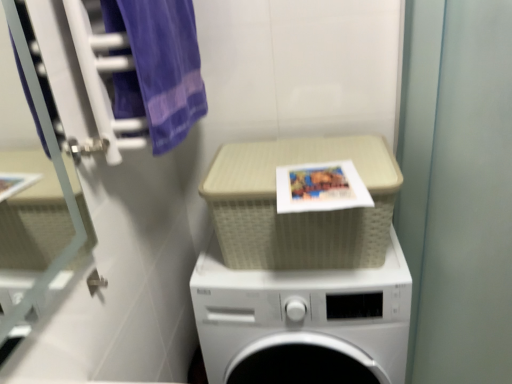
Question: Is green matte screen door at right shorter than white plastic washing machine at center?

Choices:
 (A) no
 (B) yes

Answer: (A)

Question: Is green matte screen door at right smaller than white plastic washing machine at center?

Choices:
 (A) no
 (B) yes

Answer: (A)

Question: From the image's perspective, is green matte screen door at right located above white plastic washing machine at center?

Choices:
 (A) yes
 (B) no

Answer: (A)

Question: Is green matte screen door at right thinner than white plastic washing machine at center?

Choices:
 (A) yes
 (B) no

Answer: (B)

Question: Would you say green matte screen door at right is outside white plastic washing machine at center?

Choices:
 (A) yes
 (B) no

Answer: (A)

Question: Is green matte screen door at right situated inside matte paper book cover at center or outside?

Choices:
 (A) inside
 (B) outside

Answer: (B)

Question: In the image, is green matte screen door at right on the left side or the right side of matte paper book cover at center?

Choices:
 (A) left
 (B) right

Answer: (B)

Question: From their relative heights in the image, would you say green matte screen door at right is taller or shorter than matte paper book cover at center?

Choices:
 (A) short
 (B) tall

Answer: (B)

Question: Based on their sizes in the image, would you say green matte screen door at right is bigger or smaller than matte paper book cover at center?

Choices:
 (A) small
 (B) big

Answer: (B)

Question: Is white plastic washing machine at center wider or thinner than purple cotton towel at upper left?

Choices:
 (A) thin
 (B) wide

Answer: (B)

Question: From a real-world perspective, is white plastic washing machine at center positioned above or below purple cotton towel at upper left?

Choices:
 (A) above
 (B) below

Answer: (B)

Question: Is point (393, 324) positioned closer to the camera than point (197, 87)?

Choices:
 (A) closer
 (B) farther

Answer: (A)

Question: Visually, is white plastic washing machine at center positioned to the left or to the right of purple cotton towel at upper left?

Choices:
 (A) right
 (B) left

Answer: (A)

Question: In terms of width, does matte paper book cover at center look wider or thinner when compared to transparent glass door at left?

Choices:
 (A) wide
 (B) thin

Answer: (A)

Question: Considering their positions, is matte paper book cover at center located in front of or behind transparent glass door at left?

Choices:
 (A) behind
 (B) front

Answer: (A)